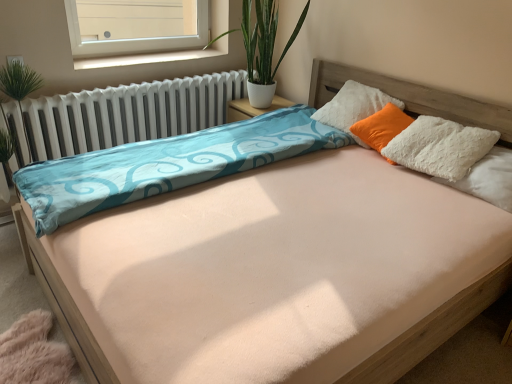
Question: Is white fluffy pillow at upper right, which ranks as the second pillow in left-to-right order, to the left or to the right of white plastic window sill at upper center in the image?

Choices:
 (A) left
 (B) right

Answer: (B)

Question: Considering the positions of white fluffy pillow at upper right, which is counted as the second pillow, starting from the back, and white plastic window sill at upper center in the image, is white fluffy pillow at upper right, which is counted as the second pillow, starting from the back, taller or shorter than white plastic window sill at upper center?

Choices:
 (A) short
 (B) tall

Answer: (B)

Question: Which object is the closest to the green leafy plant at upper center?

Choices:
 (A) white plastic window sill at upper center
 (B) white fluffy pillow at upper right, which is counted as the first pillow, starting from the left
 (C) white fluffy pillow at upper right, which is counted as the second pillow, starting from the back
 (D) white plastic window at upper left
 (E) white metallic radiator at left

Answer: (A)

Question: Based on their relative distances, which object is nearer to the white plastic window sill at upper center?

Choices:
 (A) white fluffy pillow at upper right, which is counted as the second pillow, starting from the back
 (B) green leafy plant at upper center
 (C) white plastic window at upper left
 (D) white fluffy pillow at upper right, arranged as the second pillow when viewed from the front
 (E) white metallic radiator at left

Answer: (E)